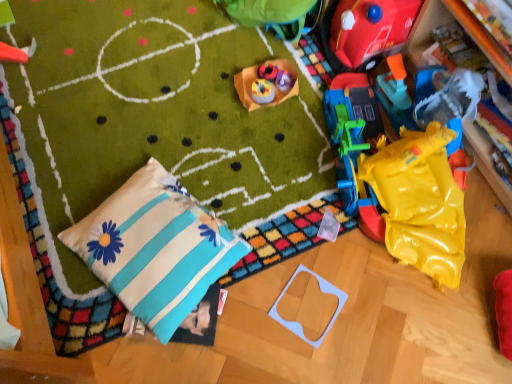
Question: In which direction should I rotate to look at matte plastic toy at center, positioned as the fourth toy in right-to-left order?

Choices:
 (A) right
 (B) left

Answer: (A)

Question: Is light blue plastic frame at lower center, placed as the fifth toy when sorted from left to right, smaller than rubberized red toy at upper left, positioned as the 4th toy in bottom-to-top order?

Choices:
 (A) no
 (B) yes

Answer: (B)

Question: Considering the relative sizes of light blue plastic frame at lower center, placed as the fifth toy when sorted from left to right, and rubberized red toy at upper left, which ranks as the sixth toy in right-to-left order, in the image provided, is light blue plastic frame at lower center, placed as the fifth toy when sorted from left to right, bigger than rubberized red toy at upper left, which ranks as the sixth toy in right-to-left order,?

Choices:
 (A) no
 (B) yes

Answer: (A)

Question: Is light blue plastic frame at lower center, which is the second toy from right to left, shorter than rubberized red toy at upper left, the third toy in the top-to-bottom sequence?

Choices:
 (A) no
 (B) yes

Answer: (B)

Question: Is light blue plastic frame at lower center, which ranks as the first toy in bottom-to-top order, facing towards rubberized red toy at upper left, which ranks as the sixth toy in right-to-left order?

Choices:
 (A) no
 (B) yes

Answer: (A)

Question: Can you confirm if light blue plastic frame at lower center, which ranks as the first toy in bottom-to-top order, is thinner than rubberized red toy at upper left, the third toy in the top-to-bottom sequence?

Choices:
 (A) yes
 (B) no

Answer: (B)

Question: Is rubberized red toy at upper left, which appears as the first toy when viewed from the left, completely or partially inside light blue plastic frame at lower center, the 6th toy in the top-to-bottom sequence?

Choices:
 (A) yes
 (B) no

Answer: (B)

Question: Does rubberized red toy at upper left, positioned as the 4th toy in bottom-to-top order, have a larger size compared to yellow rubber at right?

Choices:
 (A) no
 (B) yes

Answer: (A)

Question: From a real-world perspective, is rubberized red toy at upper left, positioned as the 4th toy in bottom-to-top order, under yellow rubber at right?

Choices:
 (A) yes
 (B) no

Answer: (A)

Question: From the image's perspective, does rubberized red toy at upper left, positioned as the 4th toy in bottom-to-top order, appear lower than yellow rubber at right?

Choices:
 (A) no
 (B) yes

Answer: (A)

Question: Can you confirm if rubberized red toy at upper left, which ranks as the sixth toy in right-to-left order, is positioned to the left of yellow rubber at right?

Choices:
 (A) no
 (B) yes

Answer: (B)

Question: Is rubberized red toy at upper left, the third toy in the top-to-bottom sequence, further to the viewer compared to yellow rubber at right?

Choices:
 (A) yes
 (B) no

Answer: (A)

Question: Is rubberized red toy at upper left, which ranks as the sixth toy in right-to-left order, completely or partially outside of yellow rubber at right?

Choices:
 (A) yes
 (B) no

Answer: (A)

Question: Is the depth of matte plastic toy at center, placed as the 5th toy when sorted from right to left, greater than that of rubberized red toy at upper left, which appears as the first toy when viewed from the left?

Choices:
 (A) yes
 (B) no

Answer: (A)